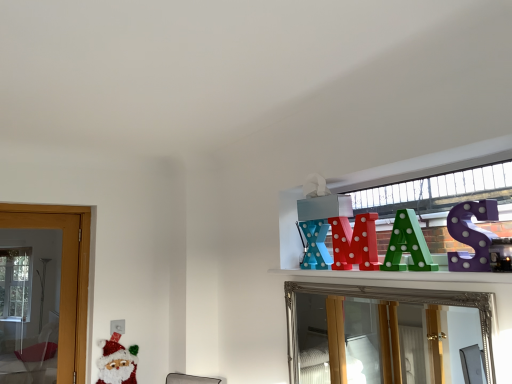
Question: Considering the relative sizes of felt santa claus at lower left and green polka dot letter a at upper center, the 2th toy when ordered from front to back, in the image provided, is felt santa claus at lower left bigger than green polka dot letter a at upper center, the 2th toy when ordered from front to back,?

Choices:
 (A) yes
 (B) no

Answer: (A)

Question: Does felt santa claus at lower left have a lesser height compared to green polka dot letter a at upper center, the 2th toy when ordered from front to back?

Choices:
 (A) no
 (B) yes

Answer: (A)

Question: Would you say felt santa claus at lower left is a long distance from green polka dot letter a at upper center, arranged as the second toy when viewed from the right?

Choices:
 (A) yes
 (B) no

Answer: (A)

Question: From the image's perspective, is felt santa claus at lower left beneath green polka dot letter a at upper center, which ranks as the third toy in left-to-right order?

Choices:
 (A) yes
 (B) no

Answer: (A)

Question: Does felt santa claus at lower left appear on the right side of green polka dot letter a at upper center, arranged as the second toy when viewed from the right?

Choices:
 (A) yes
 (B) no

Answer: (B)

Question: From a real-world perspective, is felt santa claus at lower left positioned over green polka dot letter a at upper center, which ranks as the third toy in left-to-right order, based on gravity?

Choices:
 (A) no
 (B) yes

Answer: (A)

Question: Considering the relative sizes of silver/glass mirror at upper center and felt santa claus at lower left in the image provided, is silver/glass mirror at upper center wider than felt santa claus at lower left?

Choices:
 (A) yes
 (B) no

Answer: (A)

Question: Can you confirm if silver/glass mirror at upper center is taller than felt santa claus at lower left?

Choices:
 (A) yes
 (B) no

Answer: (A)

Question: From a real-world perspective, is silver/glass mirror at upper center over felt santa claus at lower left?

Choices:
 (A) no
 (B) yes

Answer: (B)

Question: Does silver/glass mirror at upper center have a lesser height compared to felt santa claus at lower left?

Choices:
 (A) yes
 (B) no

Answer: (B)

Question: Is silver/glass mirror at upper center smaller than felt santa claus at lower left?

Choices:
 (A) yes
 (B) no

Answer: (B)

Question: Does silver/glass mirror at upper center contain felt santa claus at lower left?

Choices:
 (A) no
 (B) yes

Answer: (A)

Question: From a real-world perspective, is purple polka dot letter at upper right, arranged as the 4th toy when viewed from the back, beneath shiny red letter at upper center, arranged as the 3th toy when viewed from the front?

Choices:
 (A) yes
 (B) no

Answer: (B)